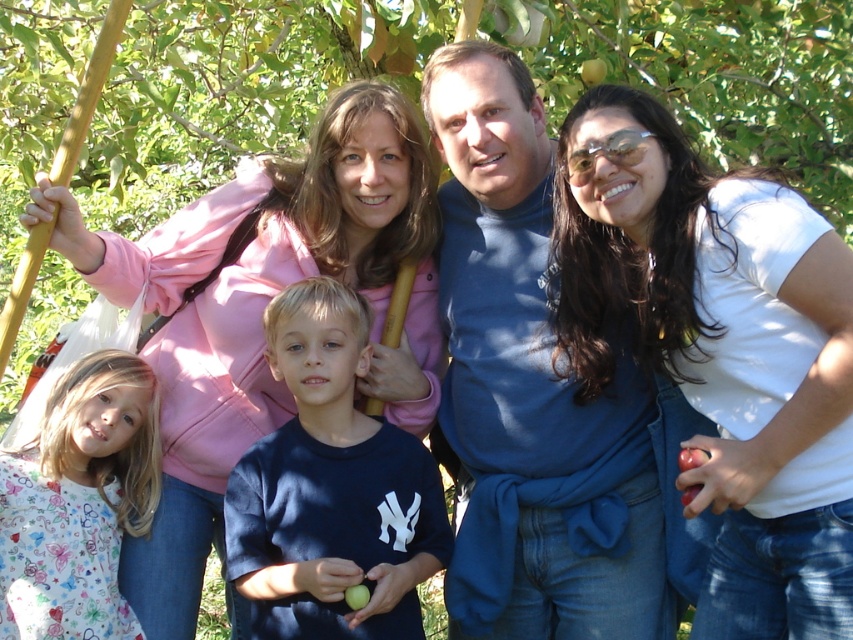
Based on the scene description, where is the pink fleece jacket at upper left located in terms of coordinates?

The pink fleece jacket at upper left is located at coordinates point (260,314).

In the scene of the apple orchard, there are two adults wearing a pink fleece jacket at upper left and a dark blue cotton shirt at center. Which adult is positioned more to the left side of the image?

The pink fleece jacket at upper left is positioned to the left of the dark blue cotton shirt at center, so the adult wearing the pink fleece jacket at upper left is more to the left.